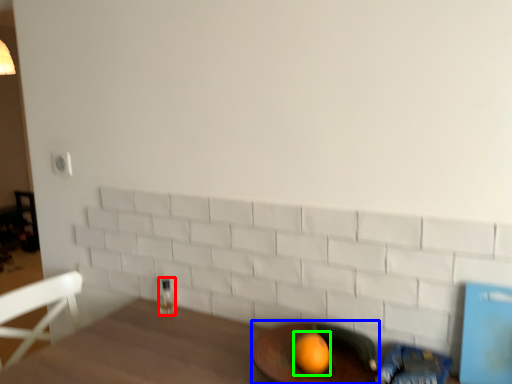
Question: Based on their relative distances, which object is nearer to beverage (highlighted by a red box)? Choose from round table (highlighted by a blue box) and orange (highlighted by a green box).

Choices:
 (A) round table
 (B) orange

Answer: (A)